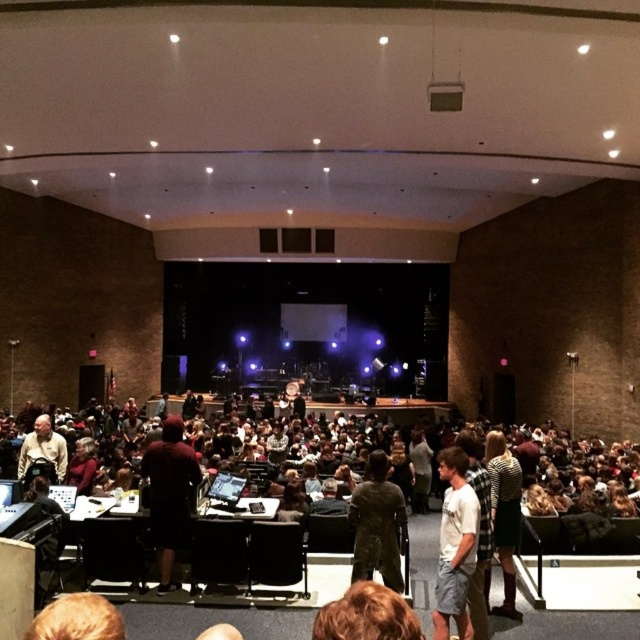
Between white cotton t-shirt at center and light brown leather jacket at lower left, which one is positioned lower?

white cotton t-shirt at center

Which is more to the left, white cotton t-shirt at center or light brown leather jacket at lower left?

light brown leather jacket at lower left is more to the left.

Where is `white cotton t-shirt at center`? white cotton t-shirt at center is located at coordinates (456, 545).

Image resolution: width=640 pixels, height=640 pixels. I want to click on white cotton t-shirt at center, so click(456, 545).